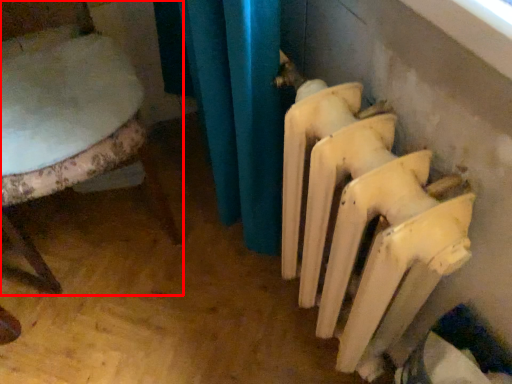
Question: Where is chair (annotated by the red box) located in relation to radiator in the image?

Choices:
 (A) right
 (B) left

Answer: (B)